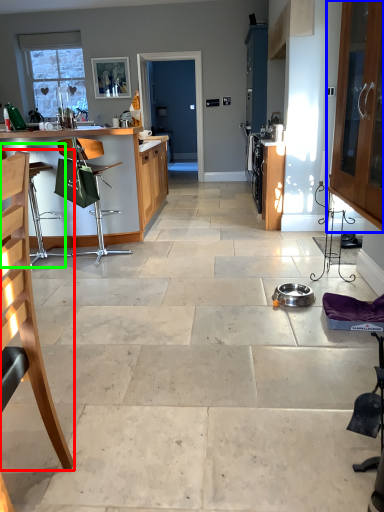
Question: Considering the real-world distances, which object is closest to chair (highlighted by a red box)? cabinetry (highlighted by a blue box) or armchair (highlighted by a green box).

Choices:
 (A) cabinetry
 (B) armchair

Answer: (A)